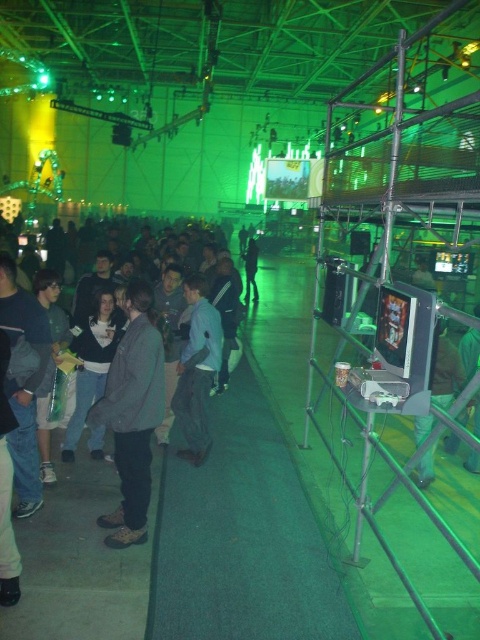
From the picture: You are an attendee at the event and need to retrieve your jacket from the walkway. You see both the gray woolen jacket at center and the light blue denim jacket at center. Which jacket is positioned to the left of the other?

The gray woolen jacket at center is to the left of the light blue denim jacket at center.

You are standing at the entrance of the walkway and want to reach the monitor on the scaffolding. There are two points marked on the walkway, point (154, 388) and point (184, 433). Which point should you step on first to get closer to the monitor?

You should step on point (154, 388) first because it is closer to the viewer than point (184, 433), so starting there would place you nearer to the monitor.

You are an attendee at the event and want to move from the green fabric pants at lower right to the dark gray hoodie at center. Given that the walkway is 1.5 meters wide, can you walk directly between them without stepping off the walkway?

The green fabric pants at lower right and dark gray hoodie at center are 11.26 meters apart. Since the walkway is 1.5 meters wide, you can walk directly between them without stepping off the walkway as the distance between them is along the walkway and the width is sufficient for movement.